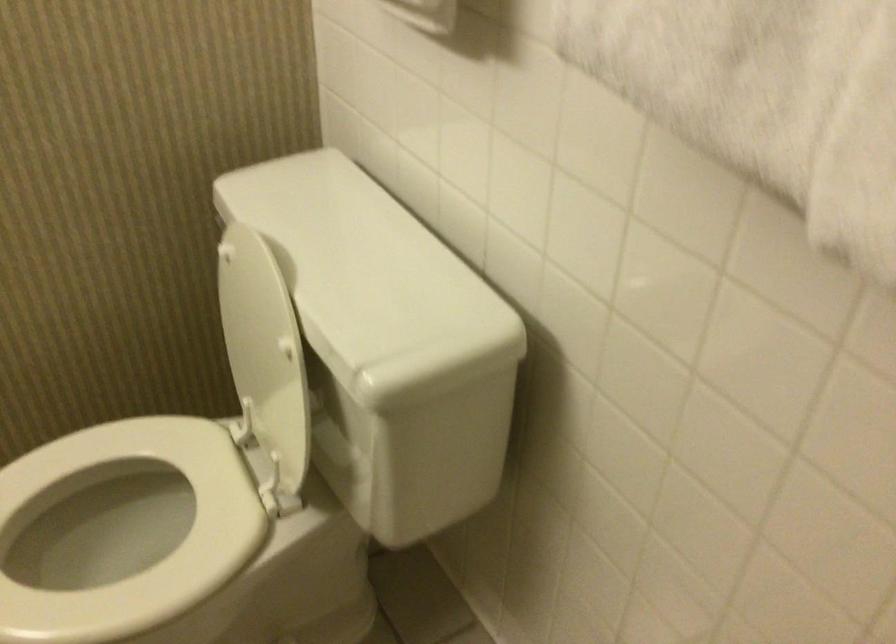
The height and width of the screenshot is (644, 896). What do you see at coordinates (97, 545) in the screenshot?
I see `the white toilet seat` at bounding box center [97, 545].